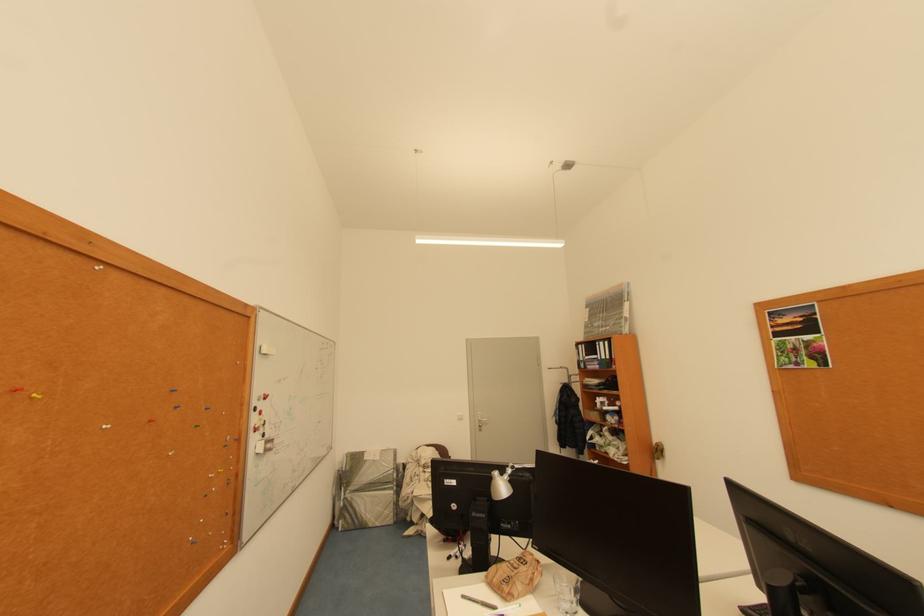
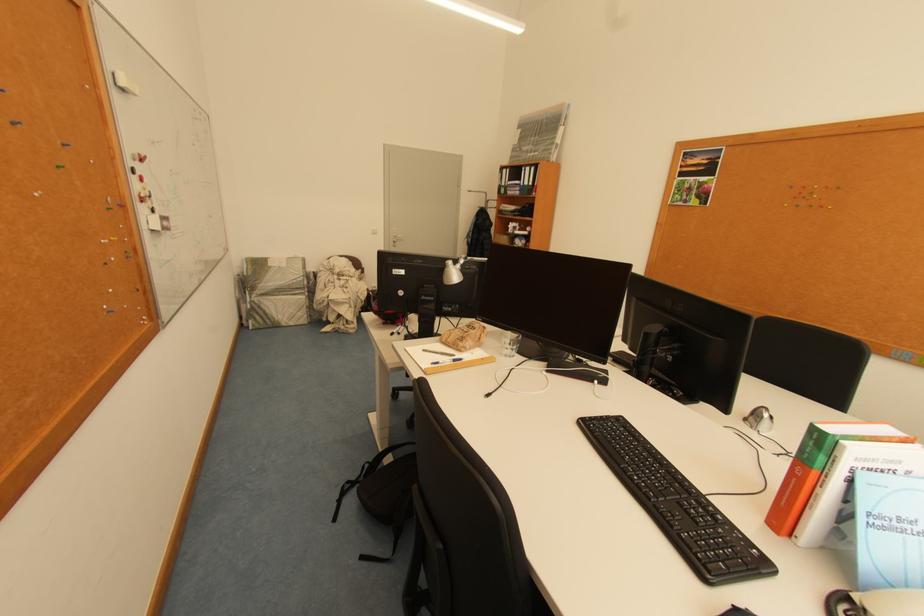
Where in the second image is the point corresponding to the point at 272,353 from the first image?

(129, 84)